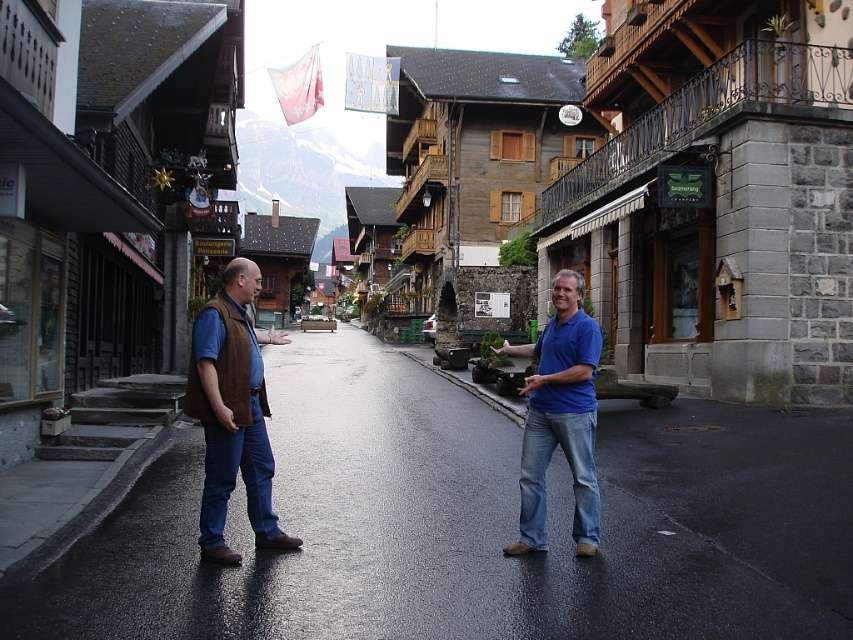
Can you confirm if brown suede vest at center is positioned below brown suede vest at left?

Indeed, brown suede vest at center is positioned under brown suede vest at left.

Between brown suede vest at center and brown suede vest at left, which one is positioned higher?

Positioned higher is brown suede vest at left.

Based on the photo, who is more distant from viewer, [202,324] or [241,284]?

The point [241,284] is behind.

This screenshot has width=853, height=640. Identify the location of brown suede vest at center. (233, 412).

Who is more forward, (x=198, y=365) or (x=532, y=419)?

Positioned in front is point (x=198, y=365).

Can you confirm if brown suede vest at left is thinner than blue denim jeans at center?

Correct, brown suede vest at left's width is less than blue denim jeans at center's.

This screenshot has width=853, height=640. In order to click on brown suede vest at left in this screenshot , I will do `click(231, 413)`.

Find the location of `brown suede vest at left`. brown suede vest at left is located at coordinates (231, 413).

Between point (225, 397) and point (521, 515), which one is positioned behind?

Point (521, 515)

Is brown suede vest at center thinner than blue denim jeans at center?

In fact, brown suede vest at center might be wider than blue denim jeans at center.

Is point (245, 360) in front of point (575, 400)?

That is True.

The height and width of the screenshot is (640, 853). Identify the location of brown suede vest at center. coord(233,412).